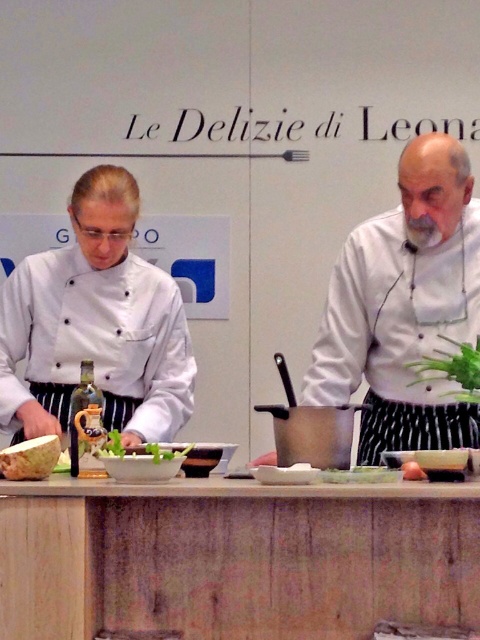
You are a guest at the cooking workshop and need to grab an ingredient from the counter. The white matte chef coat at left is blocking your access to the light brown wooden cutting board at lower left. Can you easily reach around the coat to get to the cutting board?

The white matte chef coat at left is only 18.16 inches away from the light brown wooden cutting board at lower left, so you can easily reach around the coat to access the cutting board.

You are a participant in the cooking workshop and need to locate the white chef coat at center. According to the coordinates provided, where would you find it in the image?

The white chef coat at center is located at coordinates point 0.480 on the x axis and 0.844 on the y axis.